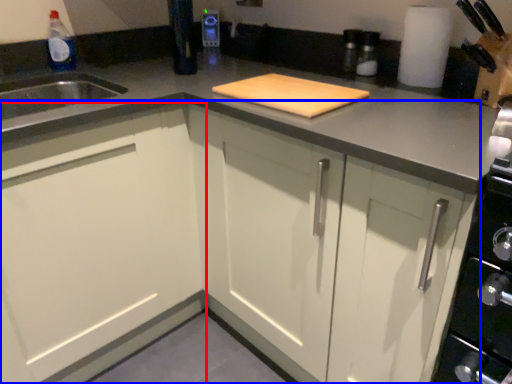
Question: Among these objects, which one is nearest to the camera, cabinetry (highlighted by a red box) or cabinetry (highlighted by a blue box)?

Choices:
 (A) cabinetry
 (B) cabinetry

Answer: (B)